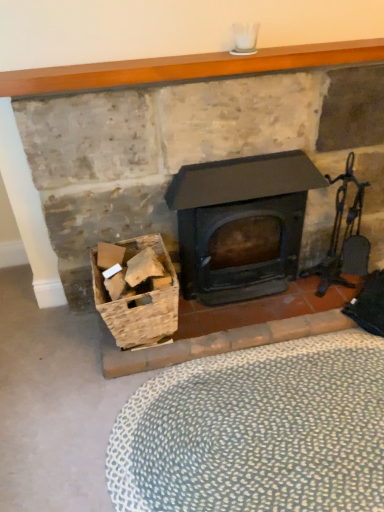
Where is `free space below smooth wooden mantle at upper center (from a real-world perspective)`? This screenshot has width=384, height=512. free space below smooth wooden mantle at upper center (from a real-world perspective) is located at coordinates (220, 77).